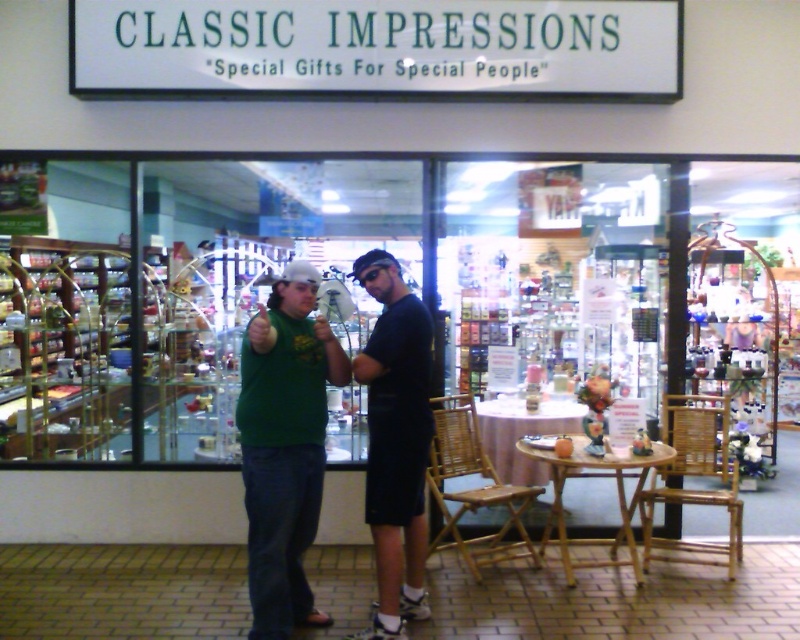
Based on the photo, is green matte t-shirt at center to the left of black matte shirt at center from the viewer's perspective?

Correct, you'll find green matte t-shirt at center to the left of black matte shirt at center.

Between point (302, 433) and point (408, 422), which one is positioned behind?

Positioned behind is point (408, 422).

Where is `green matte t-shirt at center`? The height and width of the screenshot is (640, 800). green matte t-shirt at center is located at coordinates (285, 445).

At what (x,y) coordinates should I click in order to perform the action: click on green matte t-shirt at center. Please return your answer as a coordinate pair (x, y). Looking at the image, I should click on (285, 445).